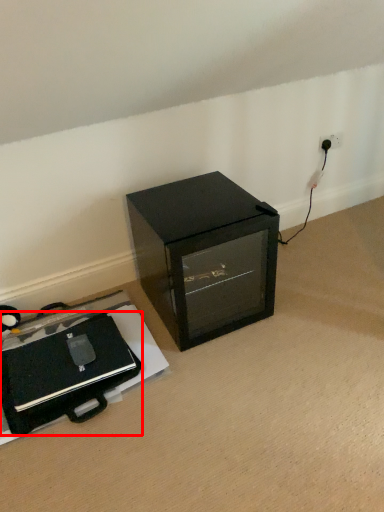
Question: From the image's perspective, what is the correct spatial positioning of wide (annotated by the red box) in reference to furniture?

Choices:
 (A) below
 (B) above

Answer: (A)